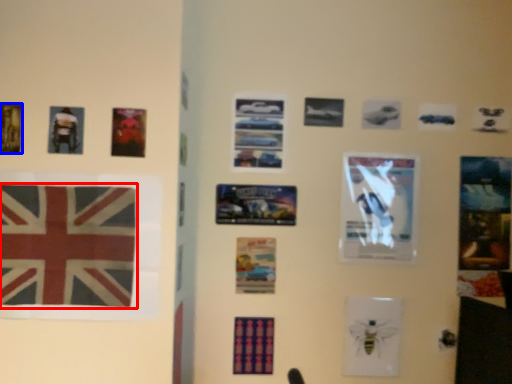
Question: Which of the following is the closest to the observer, flag (highlighted by a red box) or poster (highlighted by a blue box)?

Choices:
 (A) flag
 (B) poster

Answer: (A)